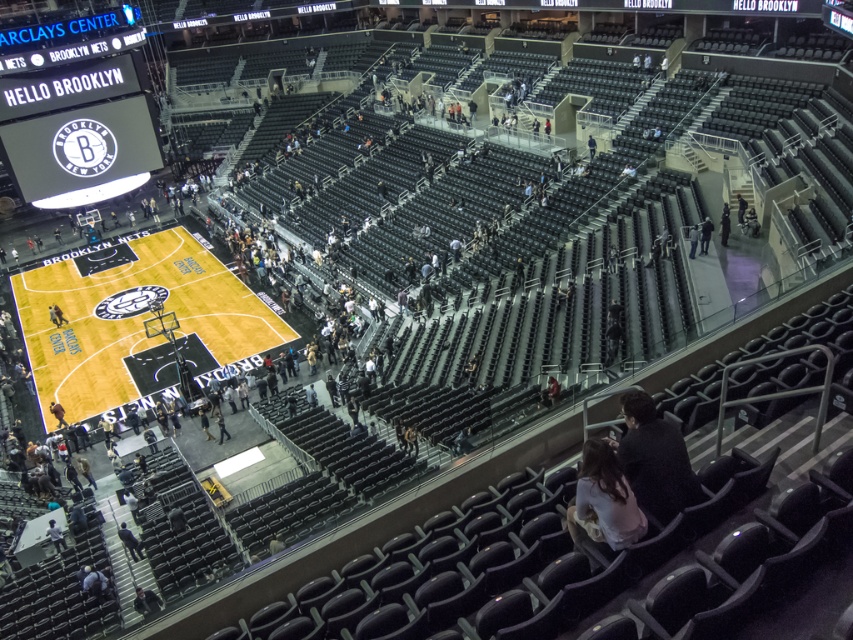
You are standing at the entrance of Barclays Center and see the yellow polished wood basketball court at center and the dark gray fabric jacket at lower left. Which object is higher in elevation?

The yellow polished wood basketball court at center is located above the dark gray fabric jacket at lower left, so it is higher in elevation.

You are standing at the center of the Barclays Center court and want to locate the white glossy scoreboard at upper left. Based on your position, in which direction should you look to see it?

The white glossy scoreboard at upper left is located at point (78, 116), so you should look to the upper left direction from the center of the court to see it.